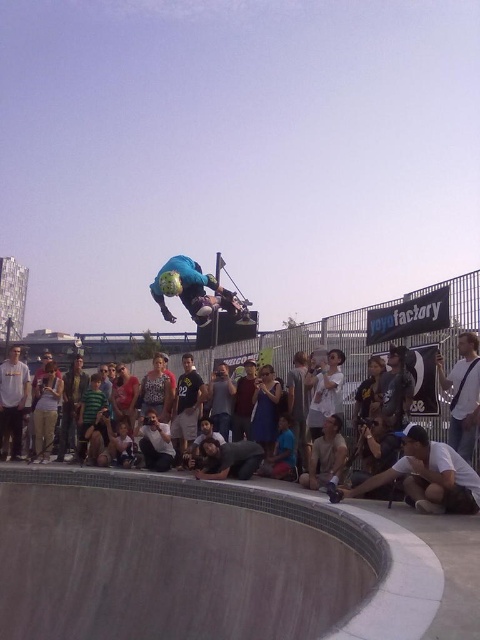
You are a photographer at the skateboarding event. You want to capture a closeup of the blue matte helmet at center and the gray cotton shirt at center in the same frame. Based on their sizes, which object should you focus on first to ensure both are in focus?

The blue matte helmet at center is wider than the gray cotton shirt at center. To ensure both are in focus, focus on the blue matte helmet at center first since its larger size will require more precise focusing.